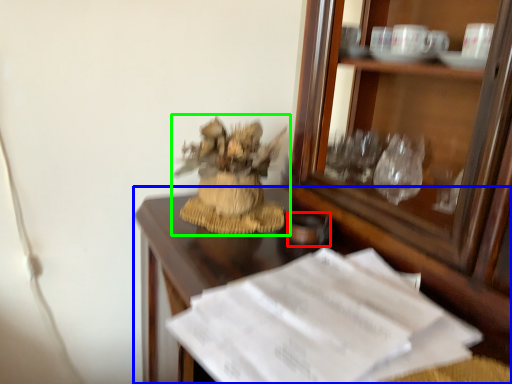
Question: Which is nearer to the tableware (highlighted by a red box)? desk (highlighted by a blue box) or houseplant (highlighted by a green box).

Choices:
 (A) desk
 (B) houseplant

Answer: (B)